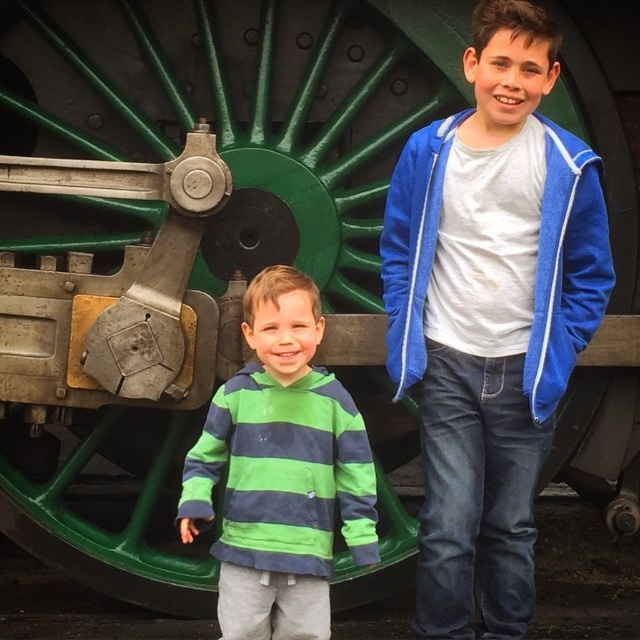
Between green striped hoodie at center and blue fleece jacket at upper right, which one is positioned lower?

green striped hoodie at center

Can you confirm if green striped hoodie at center is shorter than blue fleece jacket at upper right?

In fact, green striped hoodie at center may be taller than blue fleece jacket at upper right.

Between point (256, 548) and point (387, 292), which one is positioned behind?

The point (387, 292) is more distant.

Identify the location of green striped hoodie at center. The height and width of the screenshot is (640, 640). (280, 470).